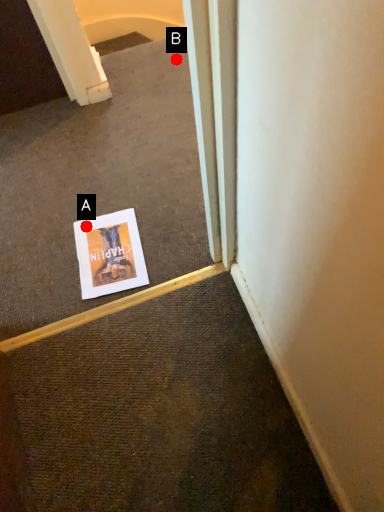
Question: Two points are circled on the image, labeled by A and B beside each circle. Which point appears closest to the camera in this image?

Choices:
 (A) A is closer
 (B) B is closer

Answer: (A)